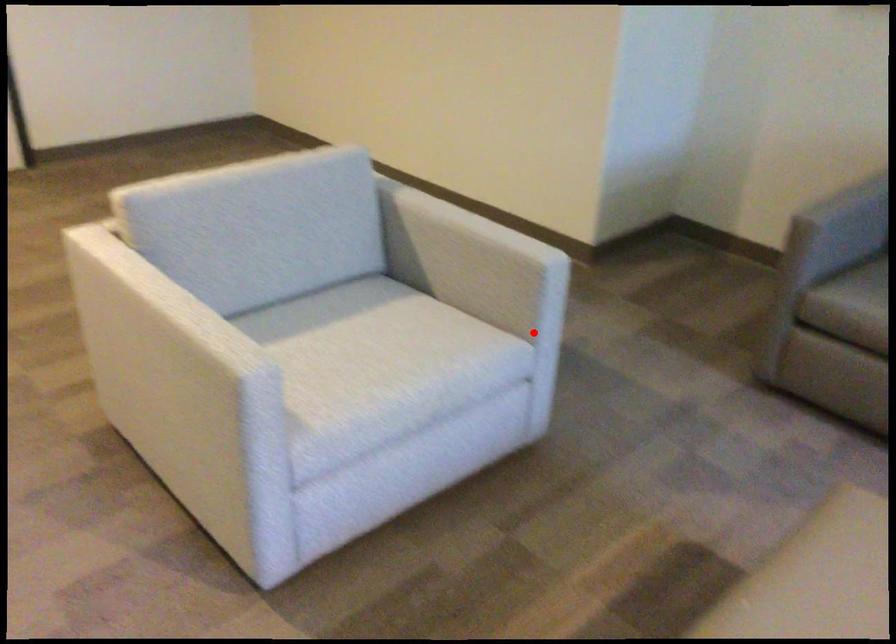
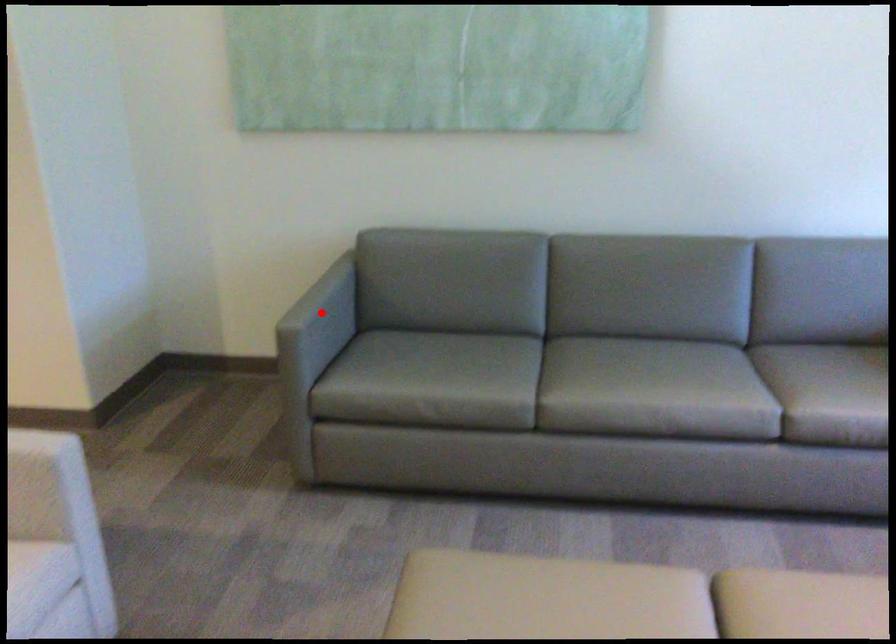
I am providing you with two images of the same scene from different viewpoints. A red point is marked on the first image and another point is marked on the second image. Are the points marked in image1 and image2 representing the same 3D position?

No